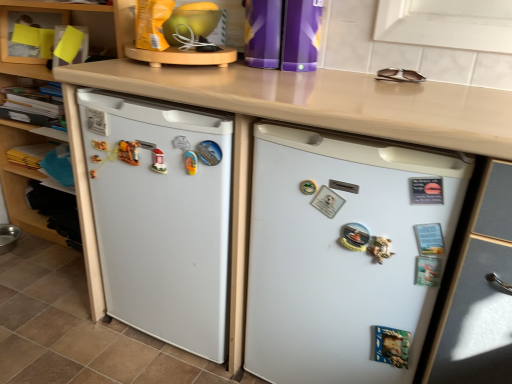
Question: Considering the relative sizes of white matte refrigerator at center, which appears as the 2th refrigerator when viewed from the left, and wooden shelf at lower left, the 2th shelf from the top, in the image provided, is white matte refrigerator at center, which appears as the 2th refrigerator when viewed from the left, thinner than wooden shelf at lower left, the 2th shelf from the top,?

Choices:
 (A) yes
 (B) no

Answer: (A)

Question: Considering the relative sizes of white matte refrigerator at center, acting as the 1th refrigerator starting from the right, and wooden shelf at lower left, the 2th shelf from the top, in the image provided, is white matte refrigerator at center, acting as the 1th refrigerator starting from the right, wider than wooden shelf at lower left, the 2th shelf from the top,?

Choices:
 (A) yes
 (B) no

Answer: (B)

Question: Is wooden shelf at lower left, the 2th shelf from the top, inside white matte refrigerator at center, acting as the 1th refrigerator starting from the right?

Choices:
 (A) yes
 (B) no

Answer: (B)

Question: Is white matte refrigerator at center, which appears as the 2th refrigerator when viewed from the left, touching wooden shelf at lower left, which is the first shelf in bottom-to-top order?

Choices:
 (A) no
 (B) yes

Answer: (A)

Question: Is white matte refrigerator at center, acting as the 1th refrigerator starting from the right, positioned beyond the bounds of wooden shelf at lower left, the 2th shelf from the top?

Choices:
 (A) no
 (B) yes

Answer: (B)

Question: Is the depth of white matte refrigerator at center, which appears as the 2th refrigerator when viewed from the left, greater than that of wooden shelf at lower left, which is the first shelf in bottom-to-top order?

Choices:
 (A) no
 (B) yes

Answer: (A)

Question: Is yellow paper at upper left, arranged as the first shelf when viewed from the top, shorter than wooden shelf at lower left, the 2th shelf from the top?

Choices:
 (A) yes
 (B) no

Answer: (B)

Question: Does yellow paper at upper left, the 2th shelf ordered from the bottom, have a greater width compared to wooden shelf at lower left, which is the first shelf in bottom-to-top order?

Choices:
 (A) yes
 (B) no

Answer: (B)

Question: From a real-world perspective, does yellow paper at upper left, the 2th shelf ordered from the bottom, stand above wooden shelf at lower left, the 2th shelf from the top?

Choices:
 (A) yes
 (B) no

Answer: (A)

Question: From the image's perspective, is yellow paper at upper left, arranged as the first shelf when viewed from the top, below wooden shelf at lower left, which is the first shelf in bottom-to-top order?

Choices:
 (A) no
 (B) yes

Answer: (A)

Question: Considering the relative positions of yellow paper at upper left, the 2th shelf ordered from the bottom, and wooden shelf at lower left, the 2th shelf from the top, in the image provided, is yellow paper at upper left, the 2th shelf ordered from the bottom, to the right of wooden shelf at lower left, the 2th shelf from the top, from the viewer's perspective?

Choices:
 (A) no
 (B) yes

Answer: (A)

Question: Is yellow paper at upper left, the 2th shelf ordered from the bottom, further to camera compared to wooden shelf at lower left, the 2th shelf from the top?

Choices:
 (A) yes
 (B) no

Answer: (A)

Question: From a real-world perspective, is wooden shelf at lower left, the 2th shelf from the top, over white matte refrigerator at left, which ranks as the first refrigerator in left-to-right order?

Choices:
 (A) no
 (B) yes

Answer: (A)